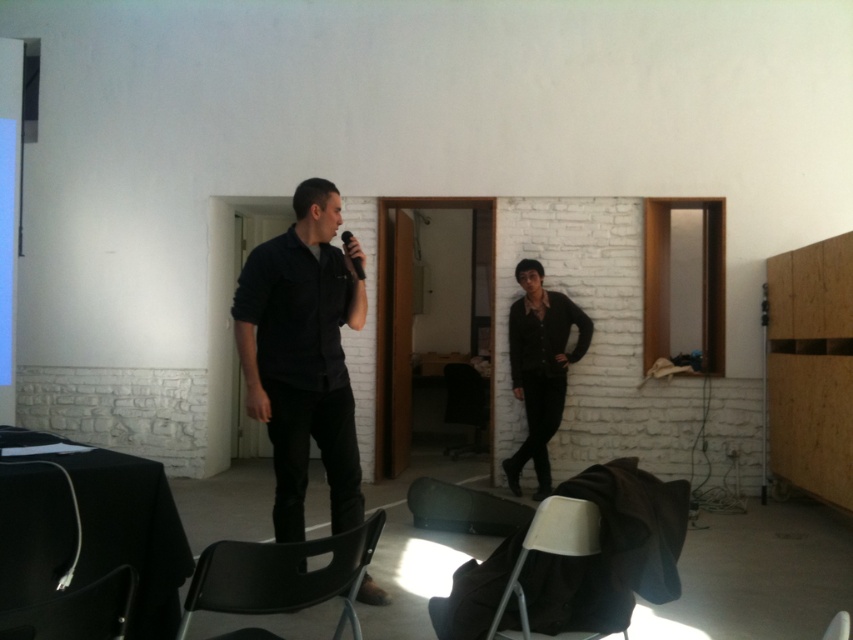
You are planning to set up a small table between the black plastic chair at lower center and the matte black chair at lower center. Which chair should the table be placed closer to if the table needs to be lower to the ground to accommodate its height?

The table should be placed closer to the black plastic chair at lower center because it is shorter than the matte black chair at lower center, ensuring the table is at a suitable height for both seats.

You are standing at the point labeled point (349, 241) in this meeting room. You need to walk to the point labeled point (276, 396). Which direction should you move to reach your destination?

You should move forward because point (276, 396) is in front of point (349, 241).

You are organizing a small event and need to seat two people. You have a black plastic chair at lower center and a matte black chair at lower center available. Which chair should you choose if you want more comfort due to size?

The black plastic chair at lower center is larger in size than the matte black chair at lower center, so it would provide more comfort due to its larger size.